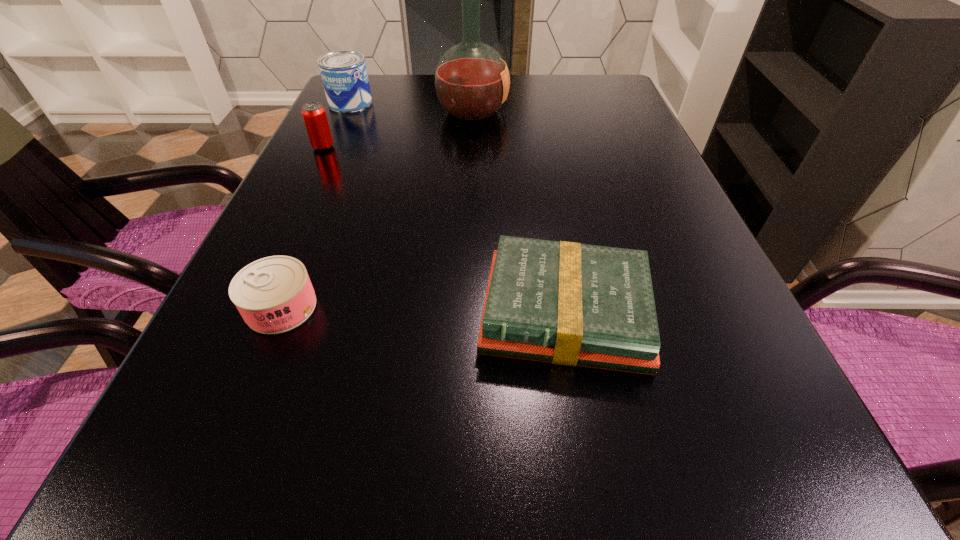
At what (x,y) coordinates should I click in order to perform the action: click on free space at the near right corner of the desktop. Please return your answer as a coordinate pair (x, y). This screenshot has height=540, width=960. Looking at the image, I should click on (784, 518).

This screenshot has height=540, width=960. Identify the location of unoccupied position between the second nearest can and the nearest can. (302, 227).

Locate an element on the screen. Image resolution: width=960 pixels, height=540 pixels. vacant space in between the third nearest object and the farthest can is located at coordinates coord(337,125).

Locate an element on the screen. This screenshot has height=540, width=960. free area in between the liquor and the hardback book is located at coordinates (518, 212).

The width and height of the screenshot is (960, 540). Find the location of `free spot between the third shortest object and the shortest can`. free spot between the third shortest object and the shortest can is located at coordinates (302, 227).

I want to click on vacant area that lies between the shortest can and the hardback book, so click(x=423, y=310).

This screenshot has width=960, height=540. I want to click on vacant point located between the hardback book and the second tallest can, so click(x=444, y=231).

This screenshot has height=540, width=960. I want to click on free point between the shortest can and the farthest can, so click(x=316, y=205).

Locate an element on the screen. The width and height of the screenshot is (960, 540). empty space between the third farthest object and the farthest can is located at coordinates (337, 125).

This screenshot has width=960, height=540. I want to click on vacant space that's between the hardback book and the farthest can, so click(x=458, y=208).